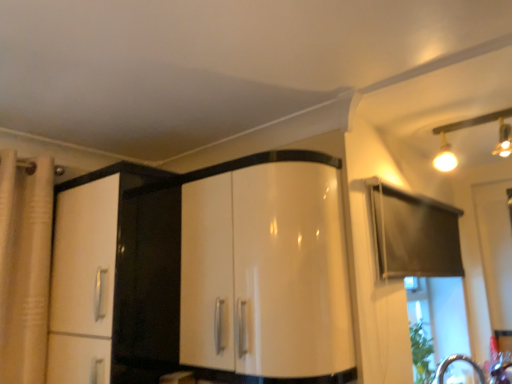
I want to click on vacant region above matte gold track lights at upper right (from a real-world perspective), so click(453, 117).